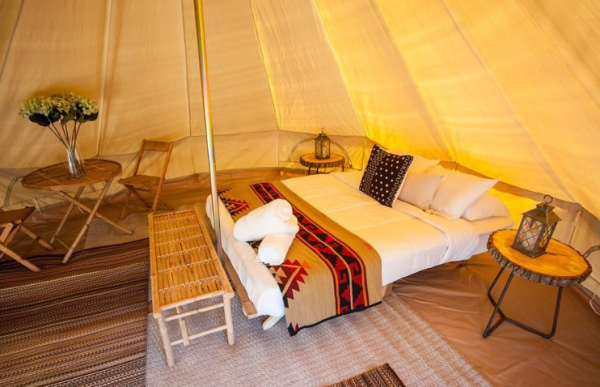
You are a GUI agent. You are given a task and a screenshot of the screen. Output one action in this format:
    pyautogui.click(x=<x>, y=<y>)
    Task: Click on the blankets
    The image size is (600, 387).
    Given the screenshot: What is the action you would take?
    pyautogui.click(x=323, y=267), pyautogui.click(x=392, y=237)